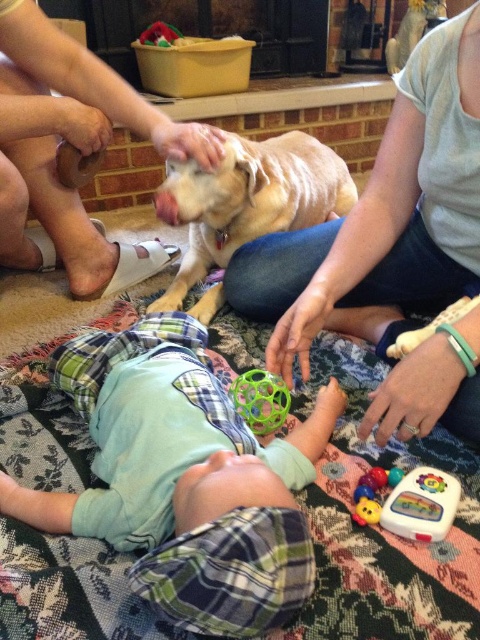
Can you confirm if light brown fur at center is smaller than translucent rubber ball at center?

No, light brown fur at center is not smaller than translucent rubber ball at center.

Who is more forward, (x=206, y=192) or (x=233, y=381)?

Positioned in front is point (x=233, y=381).

Who is more distant from viewer, (199,305) or (264,388)?

The point (199,305) is behind.

Where is `light brown fur at center`? Image resolution: width=480 pixels, height=640 pixels. light brown fur at center is located at coordinates (248, 200).

Which of these two, rubberized plastic toy at lower right or rubber teething ring at lower center, stands shorter?

Standing shorter between the two is rubber teething ring at lower center.

Is point (397, 477) positioned after point (411, 426)?

Yes, point (397, 477) is farther from viewer.

Find the location of a particular element. The height and width of the screenshot is (640, 480). rubberized plastic toy at lower right is located at coordinates (372, 493).

Describe the element at coordinates (384, 220) in the screenshot. Image resolution: width=480 pixels, height=640 pixels. I see `light blue cotton shirt at center` at that location.

Does point (383, 230) lie in front of point (273, 419)?

No, it is behind (273, 419).

Where is `light blue cotton shirt at center`? The width and height of the screenshot is (480, 640). light blue cotton shirt at center is located at coordinates (384, 220).